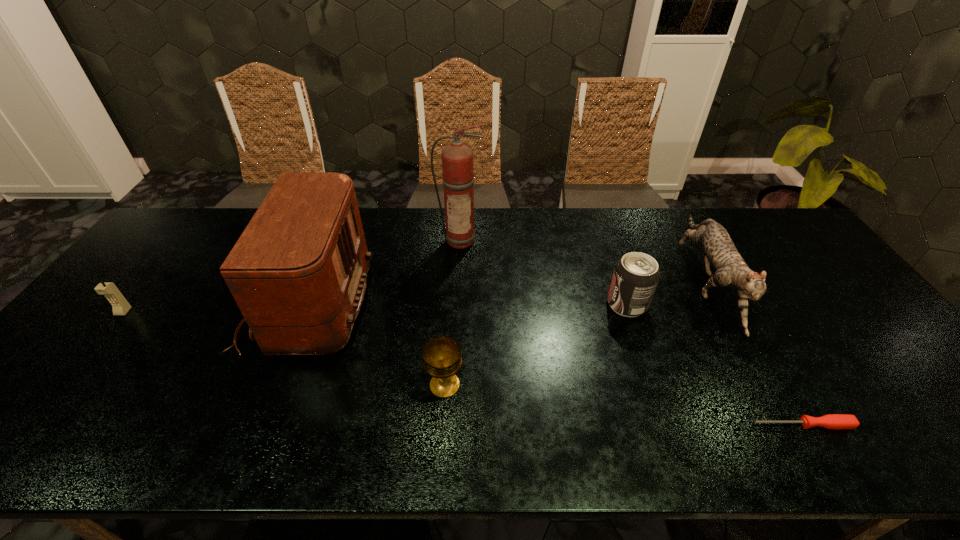
This screenshot has height=540, width=960. I want to click on vacant space located 0.140m on the side of the tallest object with the label and nozzle, so click(x=459, y=281).

In order to click on free space located on the front panel of the second tallest object in this screenshot , I will do `click(433, 304)`.

You are a GUI agent. You are given a task and a screenshot of the screen. Output one action in this format:
    pyautogui.click(x=<x>, y=<y>)
    Task: Click on the free space located 0.310m on the face of the cat
    Image resolution: width=960 pixels, height=540 pixels.
    Given the screenshot: What is the action you would take?
    pyautogui.click(x=801, y=460)

The image size is (960, 540). I want to click on vacant region located 0.180m on the front of the leftmost object, where the keypad is located, so click(76, 372).

Where is `vacant space located on the back of the third object from right to left`? This screenshot has width=960, height=540. vacant space located on the back of the third object from right to left is located at coordinates (601, 226).

I want to click on vacant space situated on the front of the chalice, so click(x=441, y=448).

Identify the location of free location located 0.270m at the tip of the shortest object. (630, 425).

In order to click on vacant space located at the tip of the shortest object in this screenshot , I will do `click(711, 425)`.

This screenshot has width=960, height=540. Identify the location of vacant position located 0.060m at the tip of the shortest object. (726, 425).

Image resolution: width=960 pixels, height=540 pixels. I want to click on fire extinguisher present at the far edge, so click(x=457, y=158).